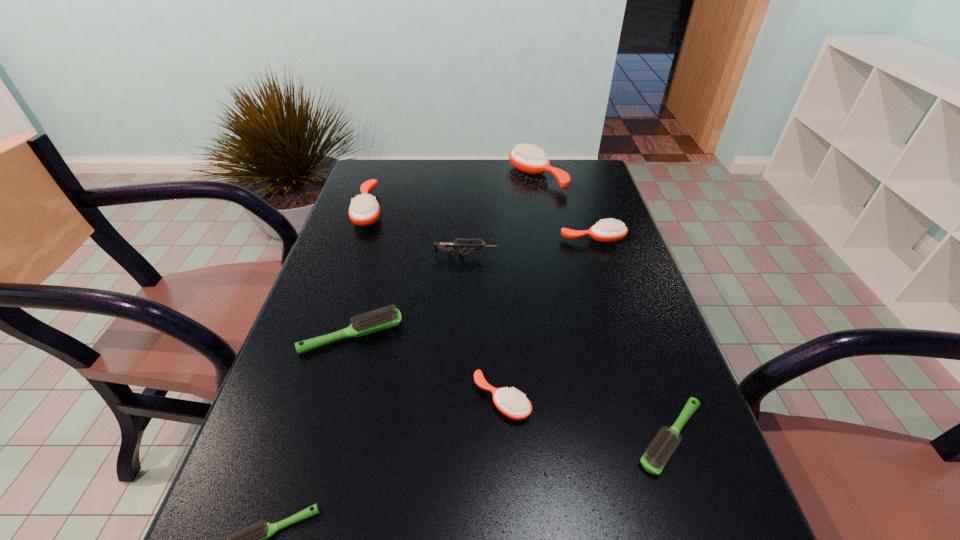
The width and height of the screenshot is (960, 540). Identify the location of free space between the nearest orange hairbrush and the grey gun. (485, 327).

Image resolution: width=960 pixels, height=540 pixels. Identify the location of object that stands as the sixth closest to the tallest object. (655, 458).

Where is `object that is the fourth closest to the grey gun`? object that is the fourth closest to the grey gun is located at coordinates (528, 159).

Select which hairbrush is the sixth closest to the smallest orange hairbrush. Please provide its 2D coordinates. Your answer should be formatted as a tuple, i.e. [(x, y)], where the tuple contains the x and y coordinates of a point satisfying the conditions above.

[(528, 159)]

Select which hairbrush appears as the closest to the tallest object. Please provide its 2D coordinates. Your answer should be formatted as a tuple, i.e. [(x, y)], where the tuple contains the x and y coordinates of a point satisfying the conditions above.

[(607, 230)]

The image size is (960, 540). In order to click on the third closest orange hairbrush to the smallest light hairbrush in this screenshot , I will do `click(607, 230)`.

Where is `orange hairbrush object that ranks as the closest to the gun`? This screenshot has width=960, height=540. orange hairbrush object that ranks as the closest to the gun is located at coordinates (607, 230).

Locate an element on the screen. light hairbrush object that ranks as the third closest to the fourth farthest object is located at coordinates (253, 539).

In order to click on light hairbrush that stands as the third closest to the fifth nearest object in this screenshot , I will do `click(253, 539)`.

Identify the location of vacant space that satisfies the following two spatial constraints: 1. on the front side of the second tallest object; 2. on the left side of the seventh tallest object. The image size is (960, 540). (294, 437).